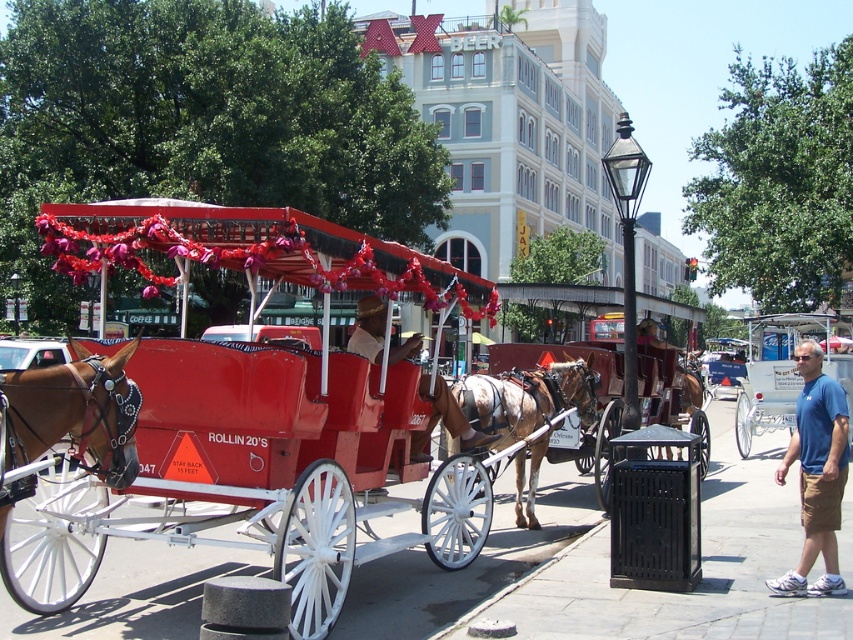
Question: Can you confirm if shiny red carriage at center is bigger than blue cotton shirt at lower right?

Choices:
 (A) no
 (B) yes

Answer: (B)

Question: Does shiny red carriage at center appear on the left side of brown glossy horse at left?

Choices:
 (A) yes
 (B) no

Answer: (B)

Question: Which is farther from the shiny red carriage at center?

Choices:
 (A) white polished wood wagon at center
 (B) brown glossy horse at left

Answer: (A)

Question: Is blue cotton shirt at lower right thinner than white polished wood wagon at center?

Choices:
 (A) no
 (B) yes

Answer: (B)

Question: Which object appears farthest from the camera in this image?

Choices:
 (A) smooth brown leather hat at center
 (B) brown glossy horse at left
 (C) blue cotton shirt at lower right

Answer: (A)

Question: Which of these objects is positioned closest to the brown glossy horse at left?

Choices:
 (A) white polished wood wagon at center
 (B) shiny red carriage at center
 (C) brown speckled horse at center

Answer: (B)